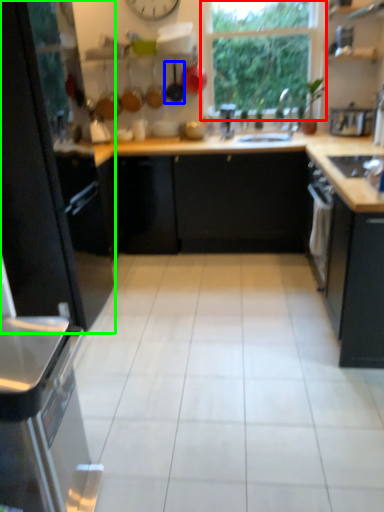
Question: Considering the real-world distances, which object is farthest from window (highlighted by a red box)? frying pan (highlighted by a blue box) or cabinetry (highlighted by a green box)?

Choices:
 (A) frying pan
 (B) cabinetry

Answer: (B)